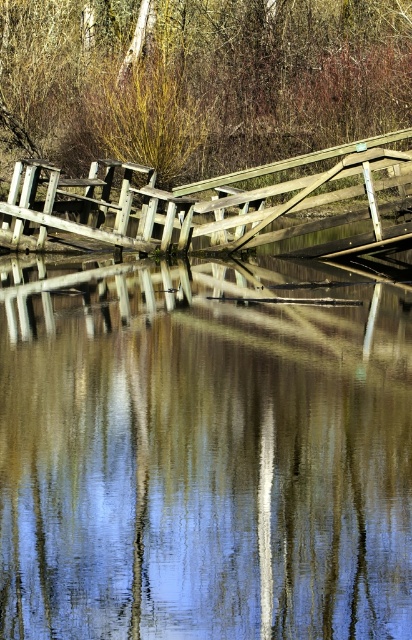
Question: Which point is farther to the camera?

Choices:
 (A) (89, 120)
 (B) (131, 310)

Answer: (A)

Question: Which point appears closest to the camera in this image?

Choices:
 (A) (381, 125)
 (B) (20, 456)

Answer: (B)

Question: Is transparent water at center closer to the viewer compared to brown wood tree at upper center?

Choices:
 (A) no
 (B) yes

Answer: (B)

Question: Which object appears farthest from the camera in this image?

Choices:
 (A) transparent water at center
 (B) brown wood tree at upper center

Answer: (B)

Question: Can you confirm if transparent water at center is positioned to the right of brown wood tree at upper center?

Choices:
 (A) yes
 (B) no

Answer: (A)

Question: Can you confirm if transparent water at center is wider than brown wood tree at upper center?

Choices:
 (A) yes
 (B) no

Answer: (B)